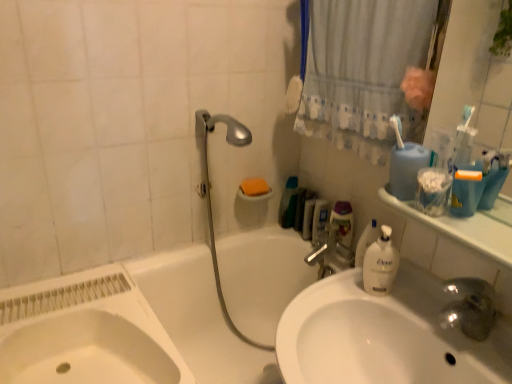
Question: Does white fabric shower curtain at upper right lie in front of white glossy sink at lower left, which is the 2th sink in right-to-left order?

Choices:
 (A) no
 (B) yes

Answer: (A)

Question: Considering the relative sizes of white fabric shower curtain at upper right and white glossy sink at lower left, which is the 2th sink in right-to-left order, in the image provided, is white fabric shower curtain at upper right taller than white glossy sink at lower left, which is the 2th sink in right-to-left order,?

Choices:
 (A) yes
 (B) no

Answer: (A)

Question: Is white fabric shower curtain at upper right facing away from white glossy sink at lower left, acting as the first sink starting from the left?

Choices:
 (A) yes
 (B) no

Answer: (B)

Question: Does white fabric shower curtain at upper right turn towards white glossy sink at lower left, which is the 2th sink in right-to-left order?

Choices:
 (A) no
 (B) yes

Answer: (A)

Question: From the image's perspective, is white fabric shower curtain at upper right located beneath white glossy sink at lower left, which is the 2th sink in right-to-left order?

Choices:
 (A) no
 (B) yes

Answer: (A)

Question: Is white fabric shower curtain at upper right next to white glossy sink at lower left, acting as the first sink starting from the left, and touching it?

Choices:
 (A) no
 (B) yes

Answer: (A)

Question: Does white glossy sink at center, which is the 1th sink in right-to-left order, turn towards silver metallic shower head at upper center?

Choices:
 (A) yes
 (B) no

Answer: (B)

Question: Are white glossy sink at center, which is the 1th sink in right-to-left order, and silver metallic shower head at upper center making contact?

Choices:
 (A) no
 (B) yes

Answer: (A)

Question: Is silver metallic shower head at upper center at the back of white glossy sink at center, which is the 1th sink in right-to-left order?

Choices:
 (A) yes
 (B) no

Answer: (B)

Question: From a real-world perspective, is white glossy sink at center, acting as the 2th sink starting from the left, on top of silver metallic shower head at upper center?

Choices:
 (A) no
 (B) yes

Answer: (A)

Question: Can you confirm if white glossy sink at center, which is the 1th sink in right-to-left order, is positioned to the left of silver metallic shower head at upper center?

Choices:
 (A) yes
 (B) no

Answer: (B)

Question: Is white glossy sink at center, acting as the 2th sink starting from the left, positioned in front of silver metallic shower head at upper center?

Choices:
 (A) yes
 (B) no

Answer: (A)

Question: Does white fabric shower curtain at upper right touch silver metallic faucet at upper center?

Choices:
 (A) no
 (B) yes

Answer: (A)